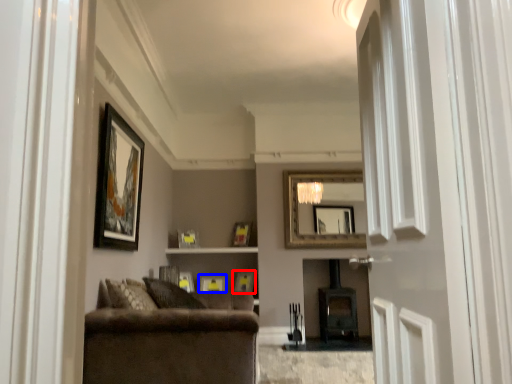
Question: Which object is further to the camera taking this photo, picture frame (highlighted by a red box) or picture frame (highlighted by a blue box)?

Choices:
 (A) picture frame
 (B) picture frame

Answer: (B)